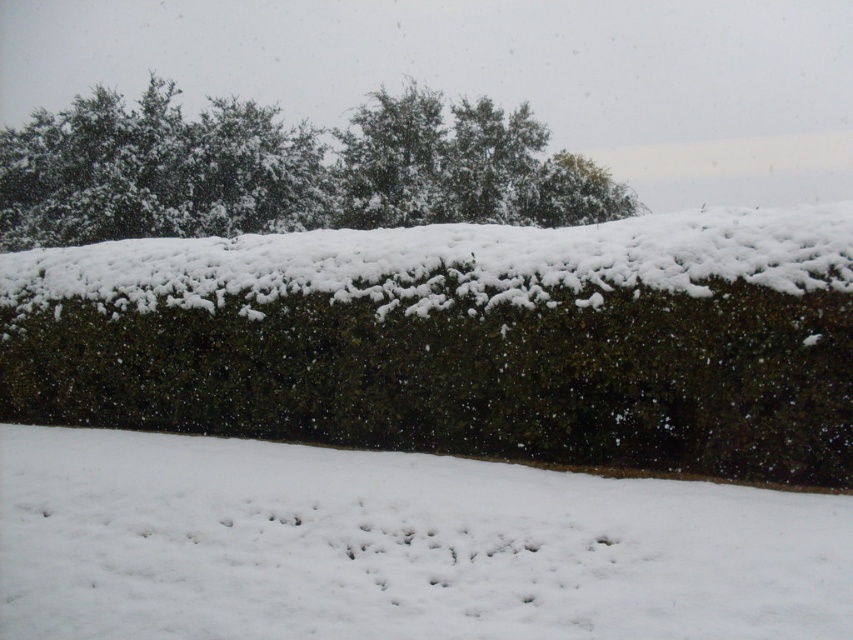
Question: Does green leafy hedge at center have a larger size compared to green leafy tree at upper center?

Choices:
 (A) yes
 (B) no

Answer: (B)

Question: Can you confirm if green leafy hedge at center is thinner than green leafy tree at upper center?

Choices:
 (A) yes
 (B) no

Answer: (A)

Question: Which point is closer to the camera taking this photo?

Choices:
 (A) [148, 145]
 (B) [257, 268]

Answer: (B)

Question: Which object is positioned closest to the white fluffy snow at lower center?

Choices:
 (A) green leafy hedge at center
 (B) green leafy tree at upper center

Answer: (A)

Question: Which point is closer to the camera?

Choices:
 (A) white fluffy snow at lower center
 (B) green leafy tree at upper center
 (C) green leafy hedge at center

Answer: (A)

Question: Does green leafy hedge at center appear on the right side of green leafy tree at upper center?

Choices:
 (A) no
 (B) yes

Answer: (B)